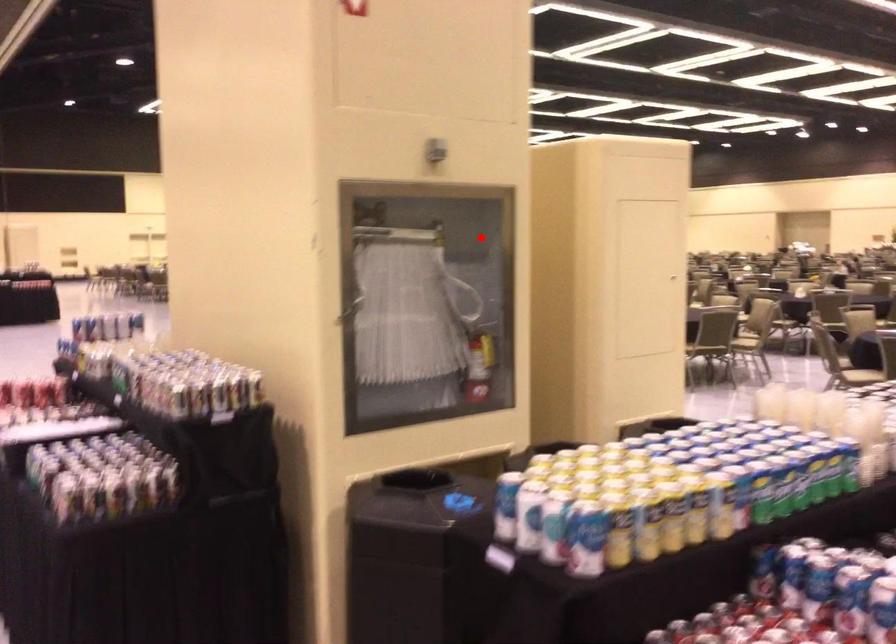
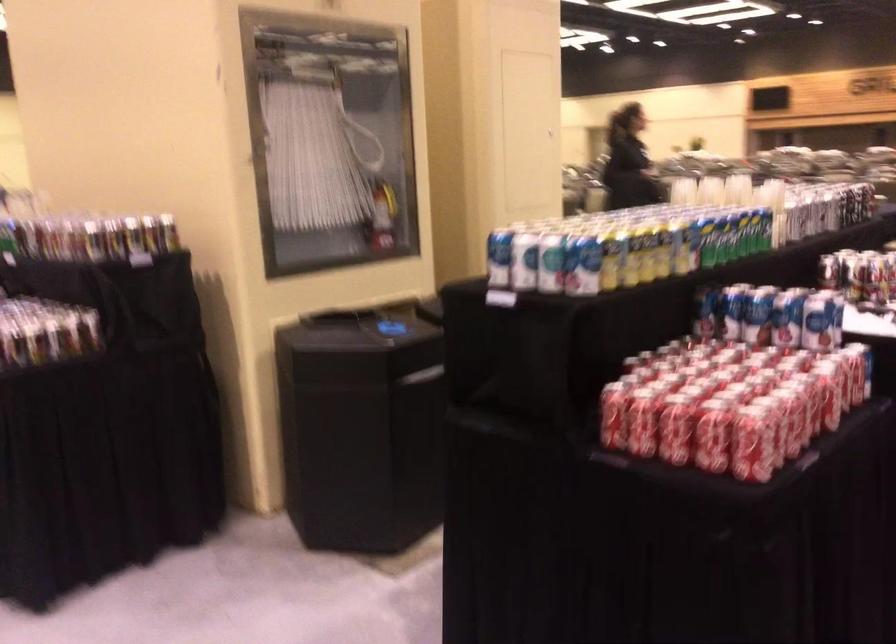
Locate, in the second image, the point that corresponds to the highlighted location in the first image.

(372, 86)